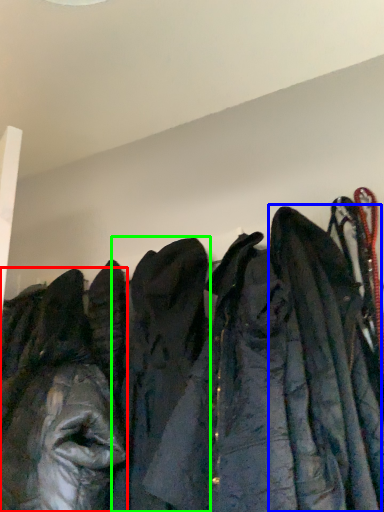
Question: Which object is positioned closest to jacket (highlighted by a red box)? Select from cloak (highlighted by a blue box) and cloak (highlighted by a green box).

Choices:
 (A) cloak
 (B) cloak

Answer: (B)